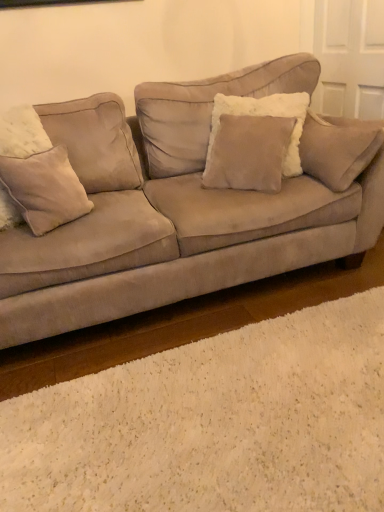
Question: Is fuzzy beige pillow at left, placed as the 2th pillow when sorted from right to left, not close to suede/velvet pillow at center, which appears as the 1th pillow when viewed from the right?

Choices:
 (A) yes
 (B) no

Answer: (B)

Question: From the image's perspective, is fuzzy beige pillow at left, the first pillow in the left-to-right sequence, above suede/velvet pillow at center, positioned as the second pillow in left-to-right order?

Choices:
 (A) no
 (B) yes

Answer: (A)

Question: Is fuzzy beige pillow at left, placed as the 2th pillow when sorted from right to left, oriented towards suede/velvet pillow at center, positioned as the second pillow in left-to-right order?

Choices:
 (A) yes
 (B) no

Answer: (B)

Question: Can you confirm if fuzzy beige pillow at left, the first pillow in the left-to-right sequence, is taller than suede/velvet pillow at center, positioned as the second pillow in left-to-right order?

Choices:
 (A) no
 (B) yes

Answer: (A)

Question: Is the position of fuzzy beige pillow at left, the first pillow in the left-to-right sequence, more distant than that of suede/velvet pillow at center, which appears as the 1th pillow when viewed from the right?

Choices:
 (A) yes
 (B) no

Answer: (B)

Question: Does fuzzy beige pillow at left, the first pillow in the left-to-right sequence, have a larger size compared to suede/velvet pillow at center, positioned as the second pillow in left-to-right order?

Choices:
 (A) yes
 (B) no

Answer: (B)

Question: From a real-world perspective, does suede/velvet pillow at center, positioned as the second pillow in left-to-right order, sit lower than fuzzy beige pillow at left, the first pillow in the left-to-right sequence?

Choices:
 (A) no
 (B) yes

Answer: (A)

Question: From a real-world perspective, is suede/velvet pillow at center, which appears as the 1th pillow when viewed from the right, located higher than fuzzy beige pillow at left, placed as the 2th pillow when sorted from right to left?

Choices:
 (A) yes
 (B) no

Answer: (A)

Question: Can you confirm if suede/velvet pillow at center, positioned as the second pillow in left-to-right order, is positioned to the right of fuzzy beige pillow at left, the first pillow in the left-to-right sequence?

Choices:
 (A) no
 (B) yes

Answer: (B)

Question: Is suede/velvet pillow at center, which appears as the 1th pillow when viewed from the right, positioned with its back to fuzzy beige pillow at left, the first pillow in the left-to-right sequence?

Choices:
 (A) yes
 (B) no

Answer: (B)

Question: Considering the relative positions of suede/velvet pillow at center, positioned as the second pillow in left-to-right order, and fuzzy beige pillow at left, placed as the 2th pillow when sorted from right to left, in the image provided, is suede/velvet pillow at center, positioned as the second pillow in left-to-right order, to the left of fuzzy beige pillow at left, placed as the 2th pillow when sorted from right to left, from the viewer's perspective?

Choices:
 (A) yes
 (B) no

Answer: (B)

Question: From the image's perspective, is suede/velvet pillow at center, which appears as the 1th pillow when viewed from the right, under fuzzy beige pillow at left, placed as the 2th pillow when sorted from right to left?

Choices:
 (A) yes
 (B) no

Answer: (B)

Question: From a real-world perspective, is suede couch at center physically above fuzzy beige pillow at left, placed as the 2th pillow when sorted from right to left?

Choices:
 (A) no
 (B) yes

Answer: (A)